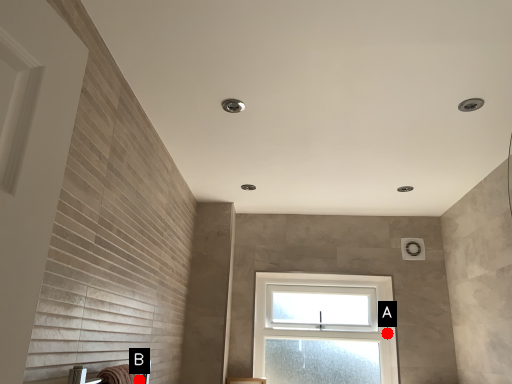
Question: Two points are circled on the image, labeled by A and B beside each circle. Which of the following is the farthest from the observer?

Choices:
 (A) A is further
 (B) B is further

Answer: (A)